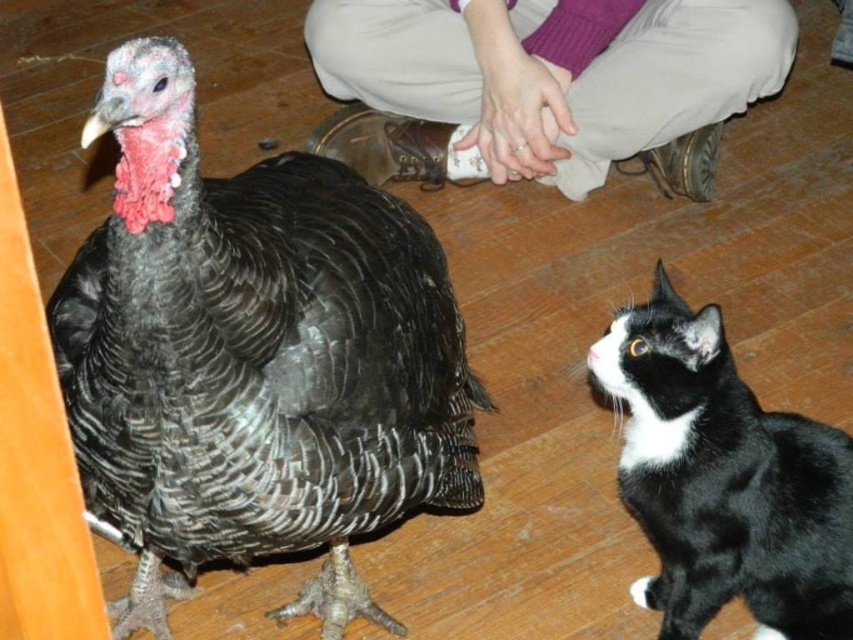
Question: Which object appears closest to the camera in this image?

Choices:
 (A) black and white fur cat at lower right
 (B) black textured turkey at center

Answer: (B)

Question: Among these objects, which one is farthest from the camera?

Choices:
 (A) beige fabric pants at upper center
 (B) black textured turkey at center
 (C) black and white fur cat at lower right

Answer: (A)

Question: Considering the relative positions of black textured turkey at center and beige fabric pants at upper center in the image provided, where is black textured turkey at center located with respect to beige fabric pants at upper center?

Choices:
 (A) right
 (B) left

Answer: (B)

Question: Is black textured turkey at center thinner than beige fabric pants at upper center?

Choices:
 (A) yes
 (B) no

Answer: (A)

Question: Can you confirm if black textured turkey at center is smaller than black and white fur cat at lower right?

Choices:
 (A) yes
 (B) no

Answer: (B)

Question: Which of the following is the farthest from the observer?

Choices:
 (A) beige fabric pants at upper center
 (B) black textured turkey at center
 (C) black and white fur cat at lower right

Answer: (A)